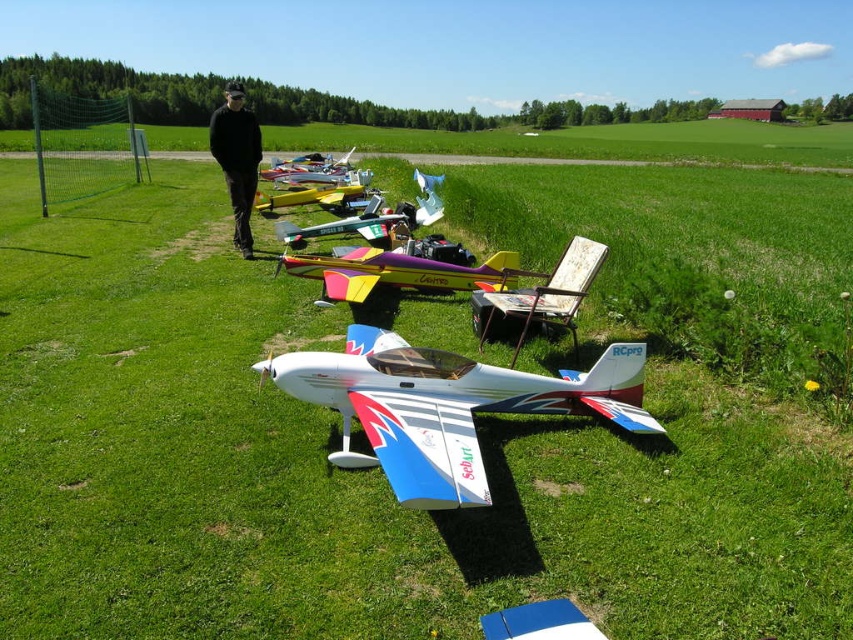
You are standing at the starting point and want to reach the yellow matte airplane at center. There is a white glossy airplane at center blocking your path. Can you walk around it without crossing the path between the two airplanes?

The white glossy airplane at center is 8.23 meters away from the yellow matte airplane at center. Since the distance between them is 8.23 meters, you can walk around the white glossy airplane at center while maintaining a path that doesn

You are planning to place a new model airplane in the grassy field. The metallic silver airplane at center and the shiny metallic airplane at center are already there. Which airplane takes up more space in the field?

The shiny metallic airplane at center takes up more space in the field because it occupies more area than the metallic silver airplane at center.